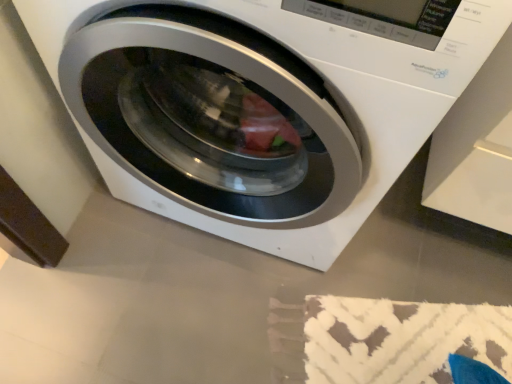
At what (x,y) coordinates should I click in order to perform the action: click on white glossy washing machine at center. Please return your answer as a coordinate pair (x, y). This screenshot has width=512, height=384. Looking at the image, I should click on (274, 96).

What do you see at coordinates (274, 96) in the screenshot? The height and width of the screenshot is (384, 512). I see `white glossy washing machine at center` at bounding box center [274, 96].

In order to face white glossy washing machine at center, should I rotate leftwards or rightwards?

Turn right by 0.524 degrees to look at white glossy washing machine at center.

This screenshot has width=512, height=384. What are the coordinates of `white glossy washing machine at center` in the screenshot? It's located at (274, 96).